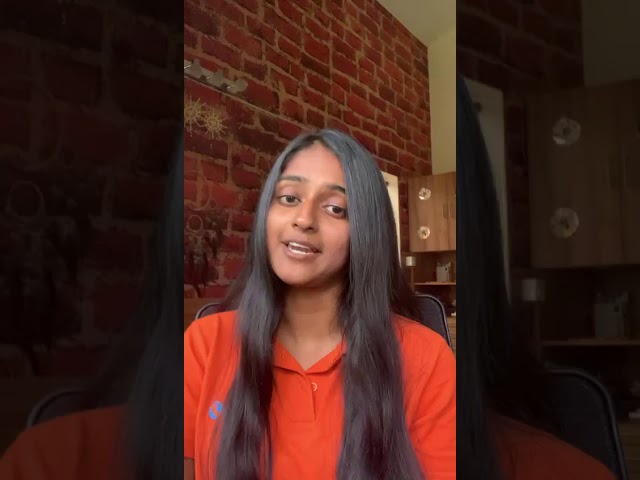
Identify the location of brick wall. (324, 61), (243, 112), (221, 36).